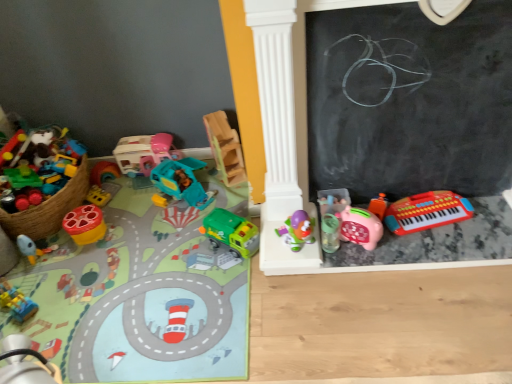
Where is `free area in between green plastic toy truck at center, placed as the eighth toy when sorted from left to right, and plastic yellow car at lower left, positioned as the 2th toy in left-to-right order`? Image resolution: width=512 pixels, height=384 pixels. free area in between green plastic toy truck at center, placed as the eighth toy when sorted from left to right, and plastic yellow car at lower left, positioned as the 2th toy in left-to-right order is located at coordinates (129, 274).